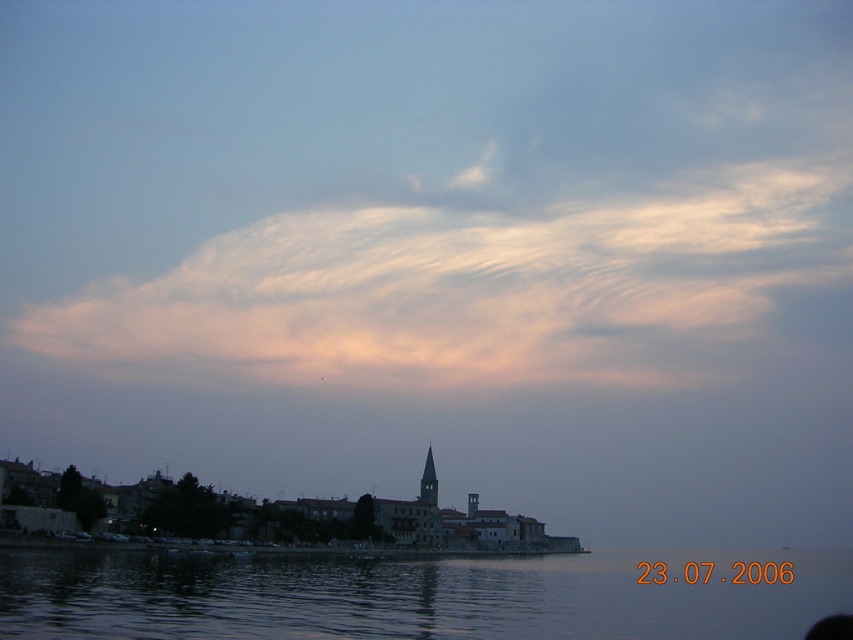
Question: Which of these objects is positioned closest to the transparent water at lower center?

Choices:
 (A) white fluffy cloud at upper center
 (B) dark gray stone tower at center

Answer: (B)

Question: Can you confirm if white fluffy cloud at upper center is thinner than transparent water at lower center?

Choices:
 (A) no
 (B) yes

Answer: (A)

Question: Among these objects, which one is nearest to the camera?

Choices:
 (A) dark gray stone tower at center
 (B) white fluffy cloud at upper center

Answer: (A)

Question: Which point is closer to the camera?

Choices:
 (A) dark gray stone tower at center
 (B) transparent water at lower center

Answer: (B)

Question: Does white fluffy cloud at upper center come in front of dark gray stone tower at center?

Choices:
 (A) no
 (B) yes

Answer: (A)

Question: Can you confirm if transparent water at lower center is positioned to the left of dark gray stone tower at center?

Choices:
 (A) no
 (B) yes

Answer: (A)